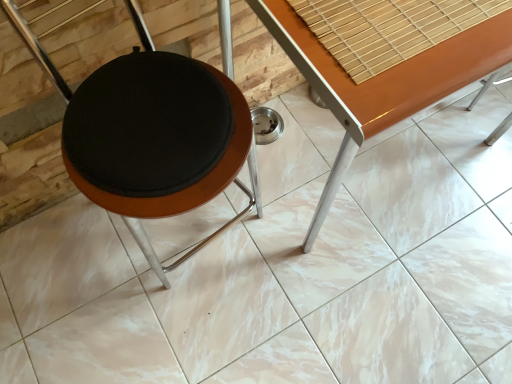
You are a GUI agent. You are given a task and a screenshot of the screen. Output one action in this format:
    pyautogui.click(x=<x>, y=<y>)
    Task: Click on the vacant space in matte black stool at center (from a real-world perspective)
    
    Given the screenshot: What is the action you would take?
    pyautogui.click(x=197, y=242)